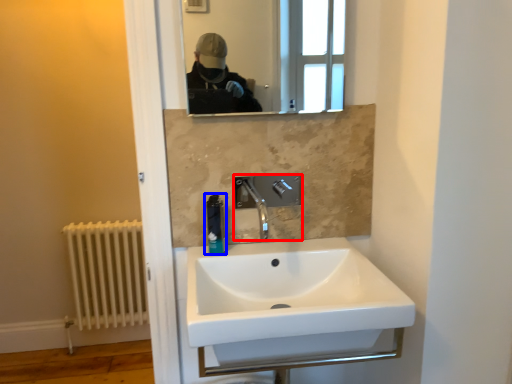
Question: Which point is closer to the camera, tap (highlighted by a red box) or soap dispenser (highlighted by a blue box)?

Choices:
 (A) tap
 (B) soap dispenser

Answer: (A)